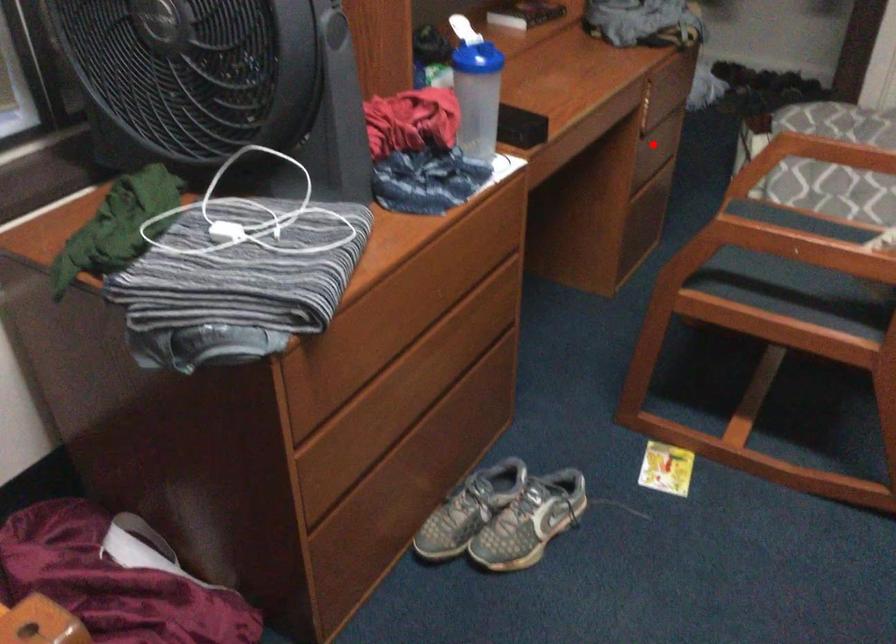
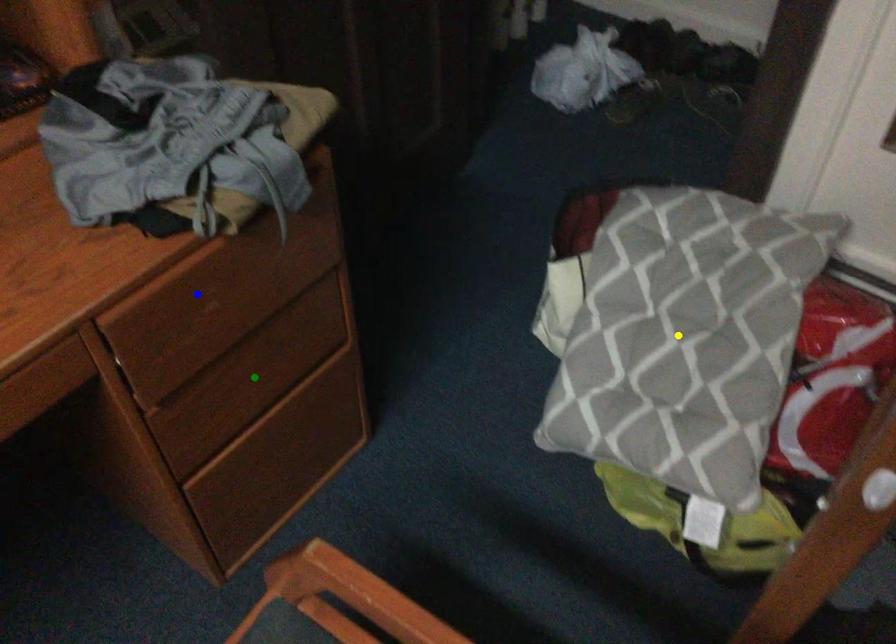
Question: I am providing you with two images of the same scene from different viewpoints. A red point is marked on the first image. You are given multiple points on the second image. Which point in image 2 is actually the same real-world point as the red point in image 1?

Choices:
 (A) yellow point
 (B) green point
 (C) blue point

Answer: (B)